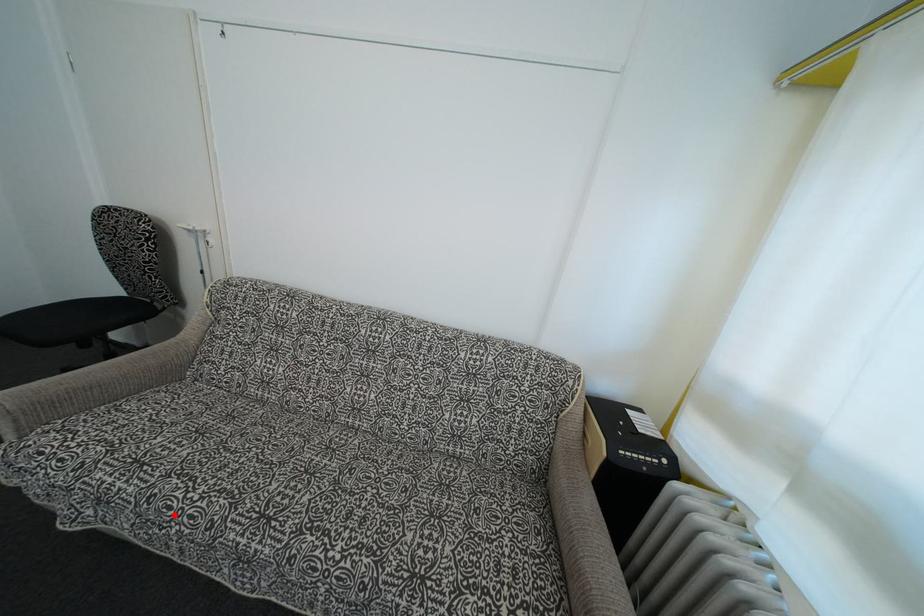
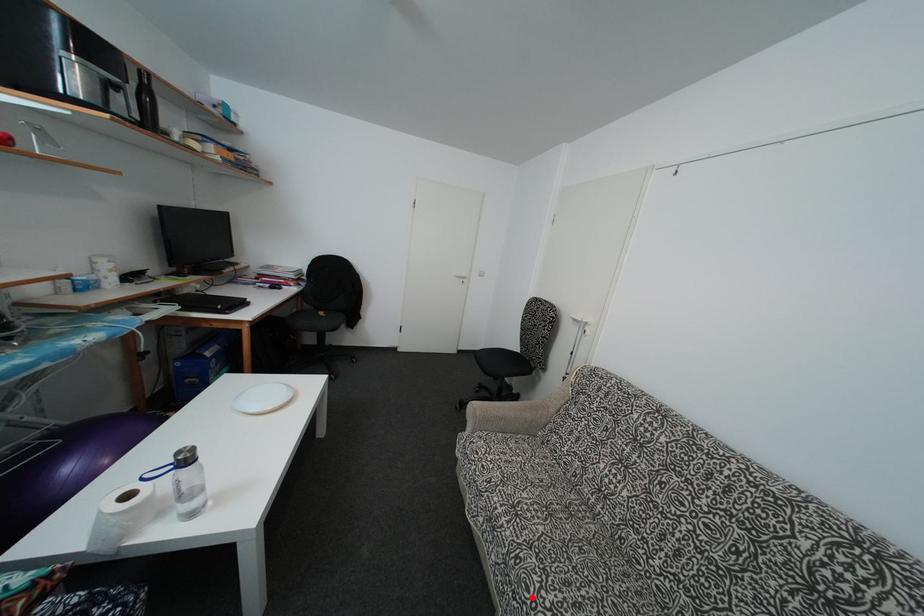
I am providing you with two images of the same scene from different viewpoints. A red point is marked on the first image and another point is marked on the second image. Do the highlighted points in image1 and image2 indicate the same real-world spot?

Yes